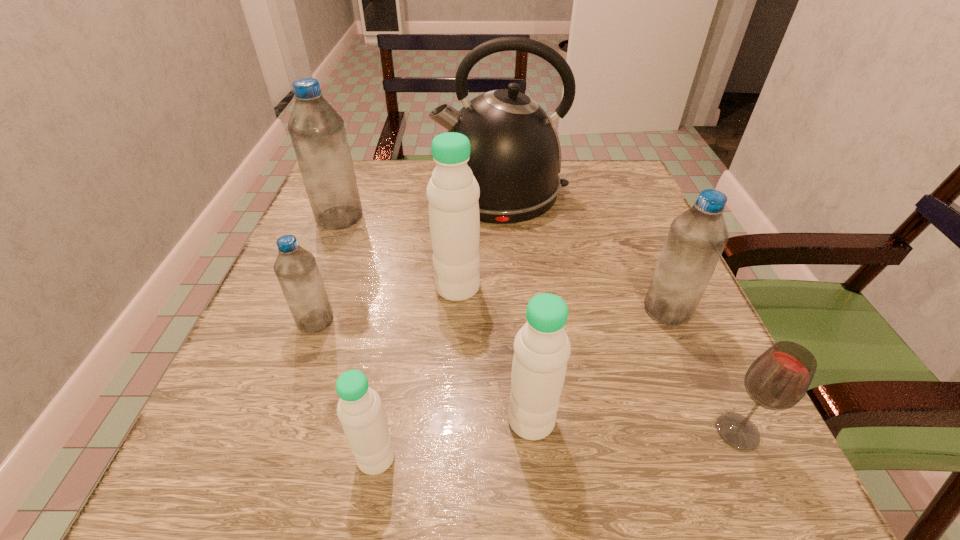
Image resolution: width=960 pixels, height=540 pixels. In the image, there is a desktop. What are the coordinates of `free space at the far edge` in the screenshot? It's located at (429, 178).

In the image, there is a desktop. Identify the location of free space at the near edge. (418, 500).

At what (x,y) coordinates should I click in order to perform the action: click on vacant space at the left edge of the desktop. Please return your answer as a coordinate pair (x, y). Looking at the image, I should click on (248, 379).

Where is `vacant region at the right edge of the desktop`? The image size is (960, 540). vacant region at the right edge of the desktop is located at coordinates (668, 357).

Find the location of `vacant space at the far left corner`. vacant space at the far left corner is located at coordinates (375, 178).

This screenshot has width=960, height=540. In order to click on free space at the far right corner of the desktop in this screenshot , I will do `click(621, 185)`.

This screenshot has height=540, width=960. Identify the location of vacant space in between the kettle and the smallest blue water bottle. (408, 256).

The height and width of the screenshot is (540, 960). In order to click on empty space between the second smallest white water bottle and the rightmost blue water bottle in this screenshot , I will do `click(599, 365)`.

What are the coordinates of `free point between the smallest blue water bottle and the rightmost blue water bottle` in the screenshot? It's located at (492, 315).

Where is `unoccupied position between the fifth water bottle from left to right and the farthest water bottle`? Image resolution: width=960 pixels, height=540 pixels. unoccupied position between the fifth water bottle from left to right and the farthest water bottle is located at coordinates (436, 319).